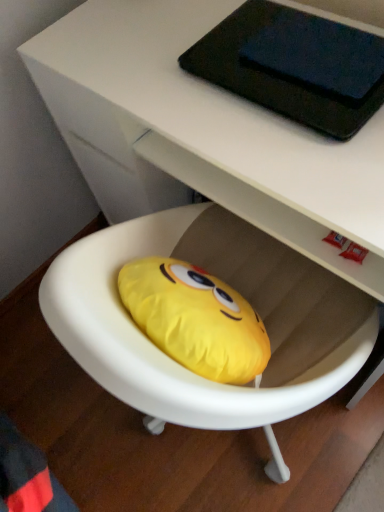
You are a GUI agent. You are given a task and a screenshot of the screen. Output one action in this format:
    pyautogui.click(x=<x>, y=<y>)
    Task: Click on the free space above black matte tablet at upper center (from a real-world perspective)
    This screenshot has width=384, height=512.
    Given the screenshot: What is the action you would take?
    point(291,58)